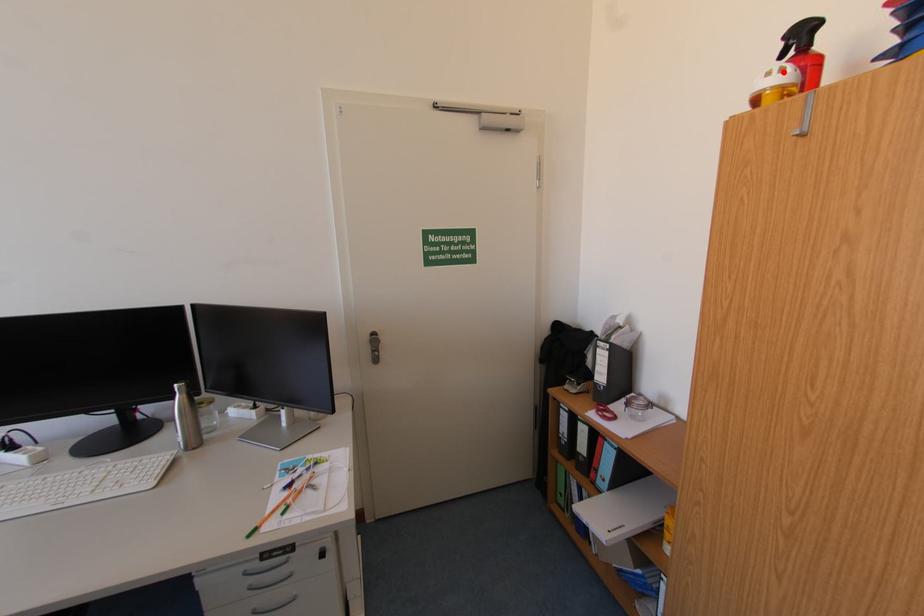
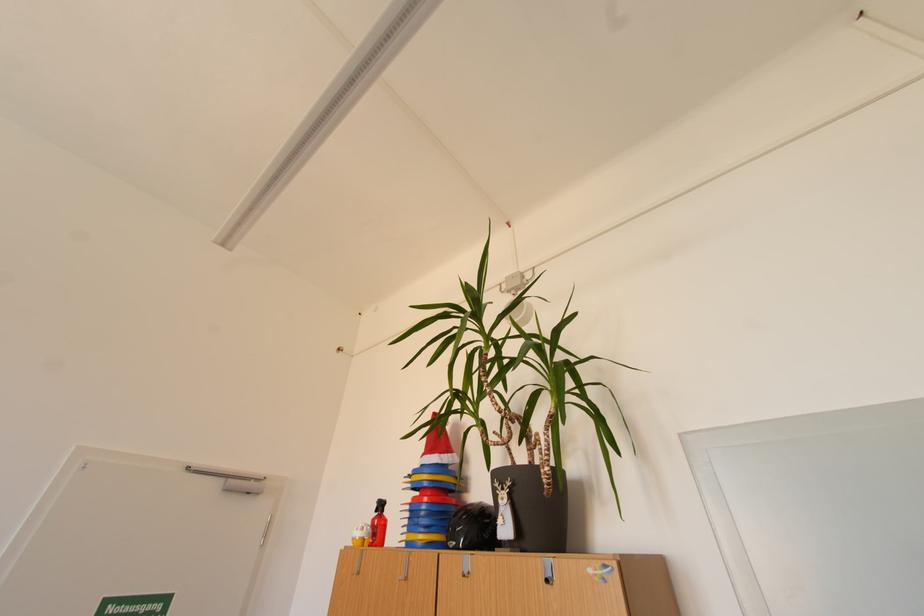
Locate, in the second image, the point that corresponds to the highlighted location in the first image.

(368, 530)